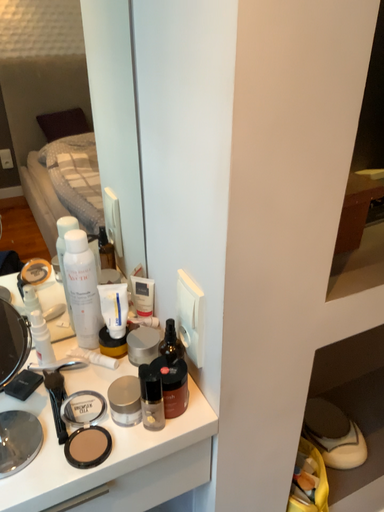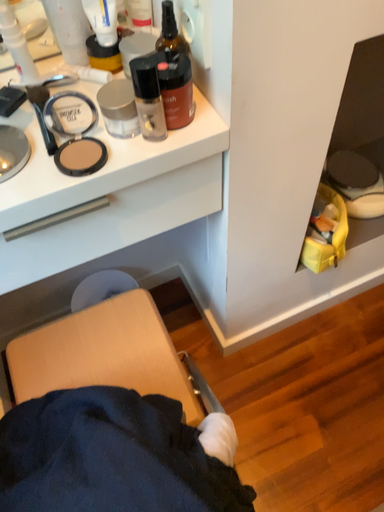
Question: How did the camera likely rotate when shooting the video?

Choices:
 (A) rotated upward
 (B) rotated downward

Answer: (B)